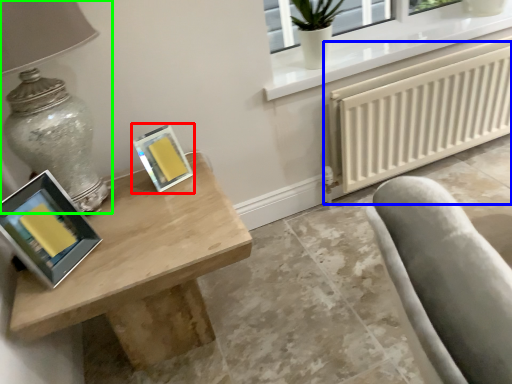
Question: Estimate the real-world distances between objects in this image. Which object is farther from picture frame (highlighted by a red box), radiator (highlighted by a blue box) or table lamp (highlighted by a green box)?

Choices:
 (A) radiator
 (B) table lamp

Answer: (A)